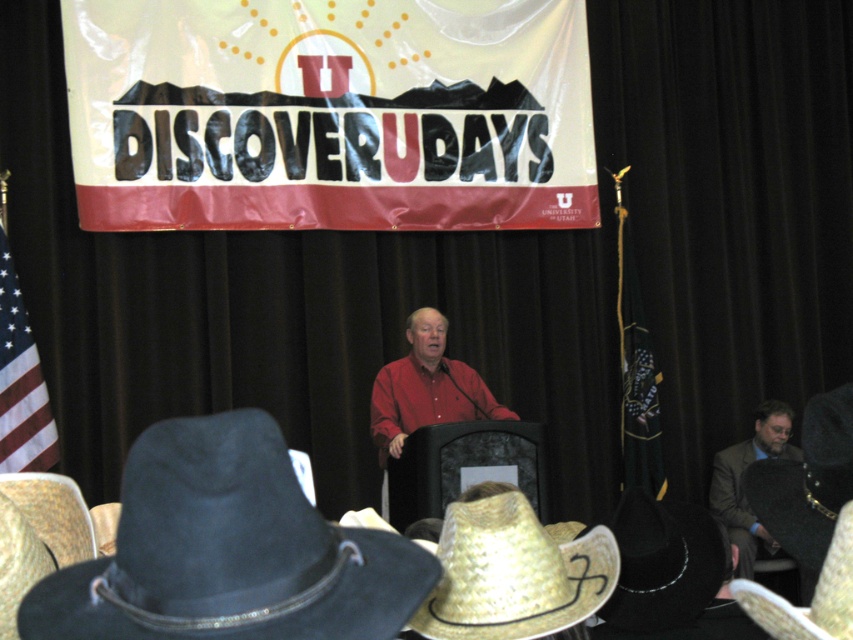
You are standing at the point marked as point (x=508, y=412) in the image. You want to walk to the stage where the man in the red shirt is speaking. Is the stage in front of you or behind you?

The stage is in front of you because the distance between you and the stage is 5.79 meters, which means the stage is ahead in your line of sight.

You are organizing a themed event and need to place two cowboy hats on the stage. The black felt cowboy hat at lower left and the straw textured cowboy hat at lower right must be arranged so that the wider one is placed on the left side of the stage. Can you determine which hat should be placed on the left?

The black felt cowboy hat at lower left is wider than the straw textured cowboy hat at lower right, so it should be placed on the left side of the stage to meet the requirement.